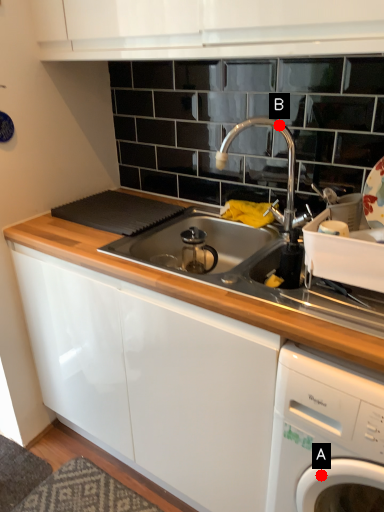
Question: Two points are circled on the image, labeled by A and B beside each circle. Which point is farther from the camera taking this photo?

Choices:
 (A) A is further
 (B) B is further

Answer: (B)